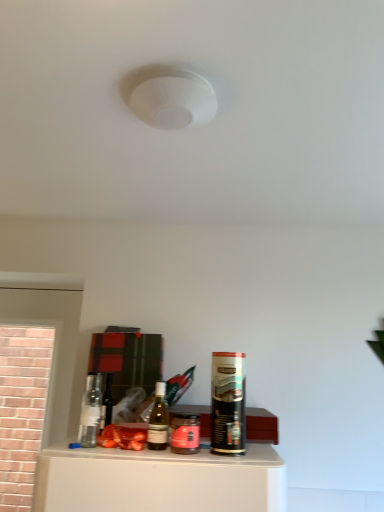
Question: Considering the positions of pink glass jar at center, which is counted as the 1th beverage, starting from the left, and matte glass wine bottle at center in the image, is pink glass jar at center, which is counted as the 1th beverage, starting from the left, bigger or smaller than matte glass wine bottle at center?

Choices:
 (A) big
 (B) small

Answer: (A)

Question: Is pink glass jar at center, which appears as the 2th beverage when viewed from the right, wider or thinner than matte glass wine bottle at center?

Choices:
 (A) thin
 (B) wide

Answer: (B)

Question: Which object is positioned farthest from the matte glass wine bottle at center?

Choices:
 (A) pink glass jar at center, which appears as the 2th beverage when viewed from the right
 (B) translucent glass bottle at center
 (C) black matte spray can at right, arranged as the 2th beverage when viewed from the left

Answer: (C)

Question: Which object is the closest to the matte glass wine bottle at center?

Choices:
 (A) pink glass jar at center, which is counted as the 1th beverage, starting from the left
 (B) translucent glass bottle at center
 (C) black matte spray can at right, arranged as the 2th beverage when viewed from the left

Answer: (B)